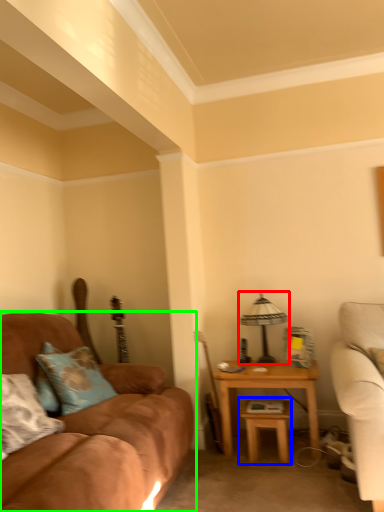
Question: Which is farther away from table lamp (highlighted by a red box)? table (highlighted by a blue box) or studio couch (highlighted by a green box)?

Choices:
 (A) table
 (B) studio couch

Answer: (B)